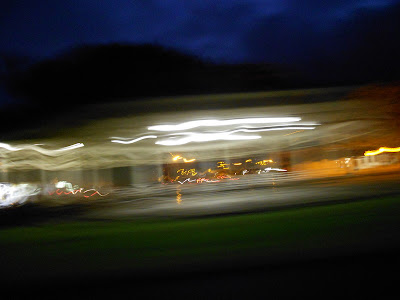
This screenshot has height=300, width=400. I want to click on lights, so click(91, 193).